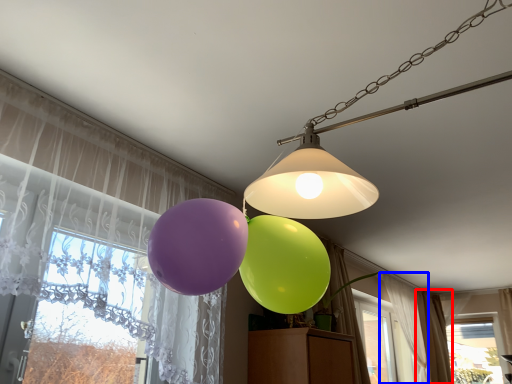
Question: Which point is further to the camera, curtain (highlighted by a red box) or curtain (highlighted by a blue box)?

Choices:
 (A) curtain
 (B) curtain

Answer: (A)